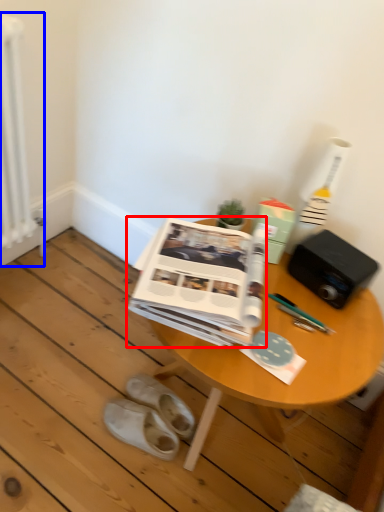
Question: Which object appears farthest to the camera in this image, paperback book (highlighted by a red box) or radiator (highlighted by a blue box)?

Choices:
 (A) paperback book
 (B) radiator

Answer: (B)